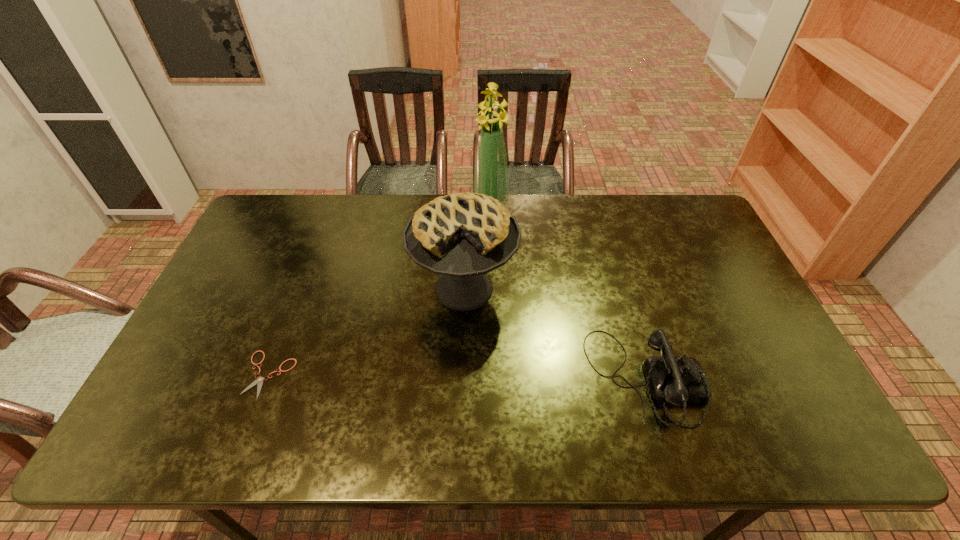
The image size is (960, 540). I want to click on vacant region located 0.130m on the front-facing side of the bouquet, so click(483, 241).

The height and width of the screenshot is (540, 960). Identify the location of vacant space located on the front-facing side of the bouquet. (473, 287).

Find the location of a particular element. free space located 0.250m on the cut side of the second tallest object is located at coordinates (395, 405).

At what (x,y) coordinates should I click in order to perform the action: click on object present at the far edge. Please return your answer as a coordinate pair (x, y). The height and width of the screenshot is (540, 960). Looking at the image, I should click on (491, 175).

I want to click on shears at the near edge, so click(259, 380).

Identify the location of telephone that is at the near edge. (677, 380).

The image size is (960, 540). Identify the location of blank area at the far edge. (525, 198).

In the image, there is a desktop. Where is `free space at the near edge`? Image resolution: width=960 pixels, height=540 pixels. free space at the near edge is located at coordinates (278, 383).

In the image, there is a desktop. At what (x,y) coordinates should I click in order to perform the action: click on free region at the near left corner. Please return your answer as a coordinate pair (x, y). Looking at the image, I should click on click(163, 393).

In the image, there is a desktop. Identify the location of vacant area at the far right corner. The width and height of the screenshot is (960, 540). (671, 226).